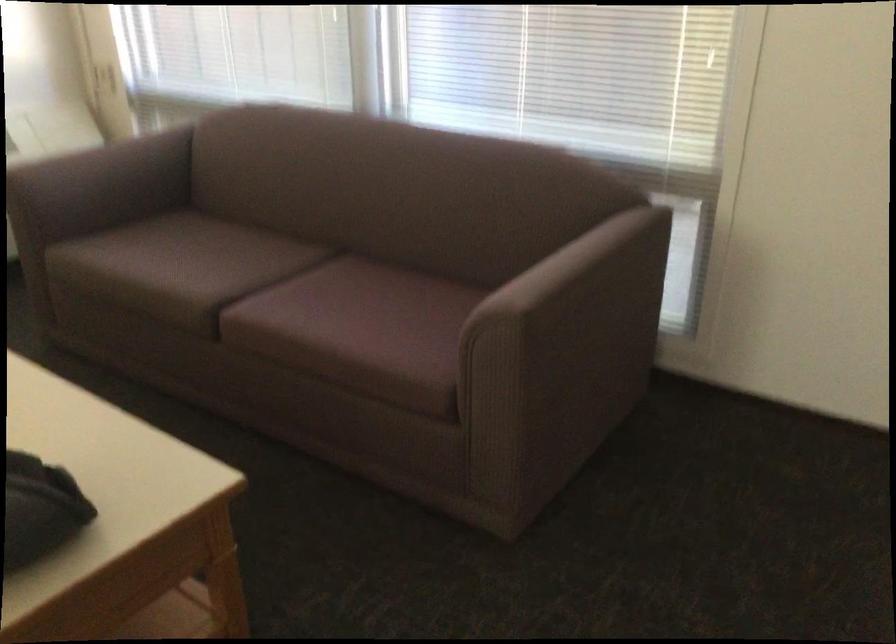
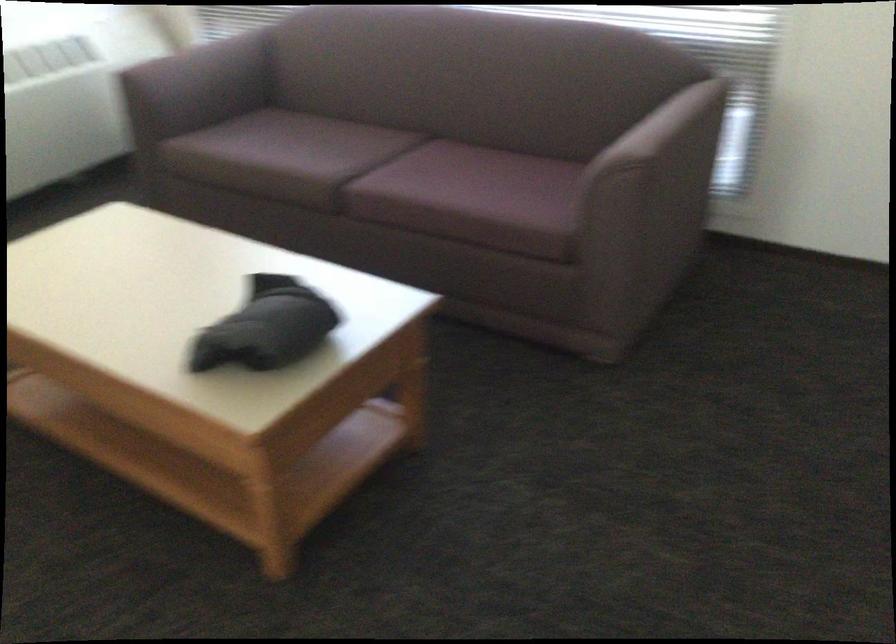
Which direction would the cameraman need to move to produce the second image?

The movement direction of the cameraman is left, backward.